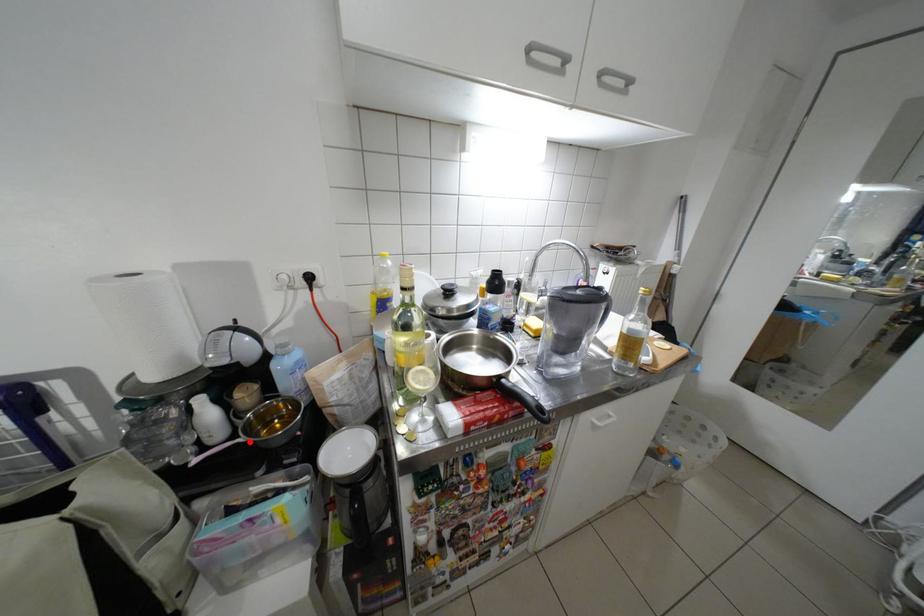
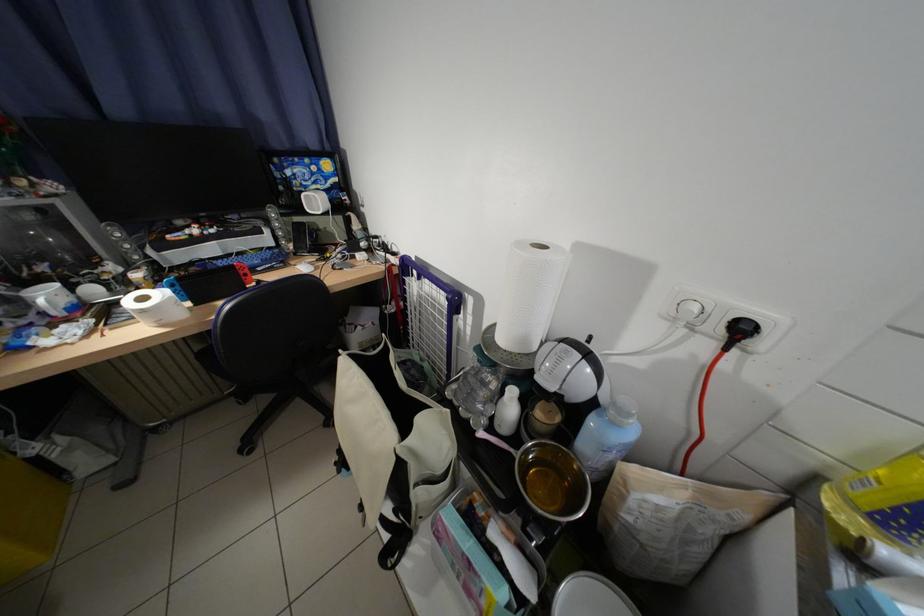
Locate, in the second image, the point that corresponds to the highlighted location in the first image.

(524, 453)